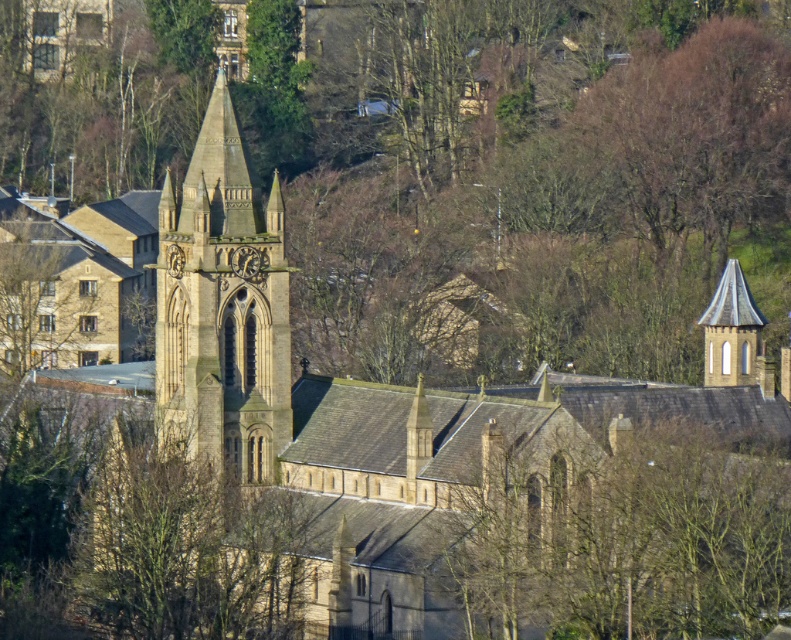
You are a photographer planning to capture the historic church from the front. You notice the brown stone tower at center and the smooth gray stone tower at right. Which tower should you focus on to ensure it takes up more space in your photo?

The brown stone tower at center is wider than the smooth gray stone tower at right, so focusing on it will ensure it takes up more space in your photo.

You are a visitor standing in front of the historic church. You notice a green leafy tree at center and a brown stone tower at center. Which object is closer to you?

Result: The green leafy tree at center is positioned under the brown stone tower at center, meaning it is closer to you.